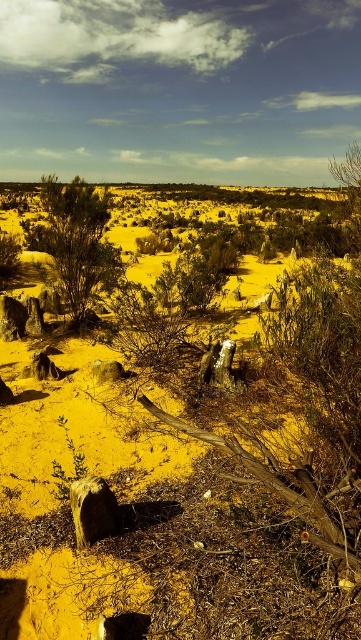
You are a hiker trying to navigate through the desert sand at center and the green matte bush at upper left. Which terrain would be easier to walk on?

The desert sand at center has a lesser height compared to the green matte bush at upper left, so it would be easier to walk on the desert sand at center since it is flatter.

You are a hiker trying to navigate through the desert sand at center and the green matte bush at upper left. Which area would you choose to walk on if you want to cover more ground quickly?

The green matte bush at upper left occupies more space than the desert sand at center, so walking on the desert sand at center would allow you to cover more ground quickly since it requires less maneuvering around the larger area of the bush.